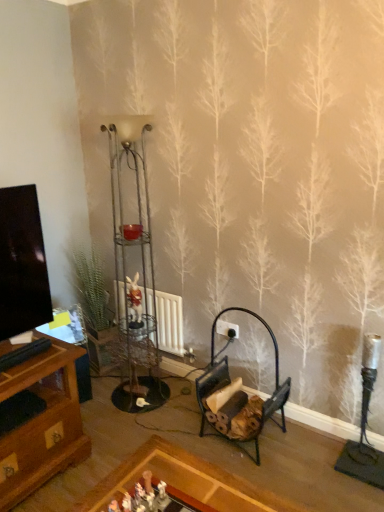
Question: Considering the relative sizes of black metal firewood rack at lower center and white plastic toy at center, marked as the first toy in a bottom-to-top arrangement, in the image provided, is black metal firewood rack at lower center smaller than white plastic toy at center, marked as the first toy in a bottom-to-top arrangement,?

Choices:
 (A) no
 (B) yes

Answer: (A)

Question: Does black metal firewood rack at lower center have a greater height compared to white plastic toy at center, acting as the 2th toy starting from the back?

Choices:
 (A) no
 (B) yes

Answer: (B)

Question: Is black metal firewood rack at lower center behind white plastic toy at center, which appears as the first toy when viewed from the right?

Choices:
 (A) no
 (B) yes

Answer: (B)

Question: Does black metal firewood rack at lower center have a lesser height compared to white plastic toy at center, arranged as the first toy when viewed from the front?

Choices:
 (A) no
 (B) yes

Answer: (A)

Question: Is black metal firewood rack at lower center looking in the opposite direction of white plastic toy at center, which is the 2th toy in left-to-right order?

Choices:
 (A) yes
 (B) no

Answer: (B)

Question: Is black metal firewood rack at lower center with white plastic toy at center, marked as the first toy in a bottom-to-top arrangement?

Choices:
 (A) yes
 (B) no

Answer: (B)

Question: Is white plastic toy at center, marked as the first toy in a bottom-to-top arrangement, positioned with its back to white matte radiator at center?

Choices:
 (A) no
 (B) yes

Answer: (A)

Question: Is white plastic toy at center, marked as the first toy in a bottom-to-top arrangement, wider than white matte radiator at center?

Choices:
 (A) yes
 (B) no

Answer: (B)

Question: Is white plastic toy at center, which is the 2th toy from top to bottom, thinner than white matte radiator at center?

Choices:
 (A) no
 (B) yes

Answer: (B)

Question: Does white plastic toy at center, marked as the first toy in a bottom-to-top arrangement, have a smaller size compared to white matte radiator at center?

Choices:
 (A) no
 (B) yes

Answer: (B)

Question: From the image's perspective, would you say white plastic toy at center, which is the 2th toy from top to bottom, is shown under white matte radiator at center?

Choices:
 (A) no
 (B) yes

Answer: (B)

Question: Is white plastic toy at center, which is the 2th toy from top to bottom, outside white matte radiator at center?

Choices:
 (A) no
 (B) yes

Answer: (B)

Question: Can you see black metal firewood rack at lower center touching white glossy rabbit at center, which is the first toy in left-to-right order?

Choices:
 (A) yes
 (B) no

Answer: (B)